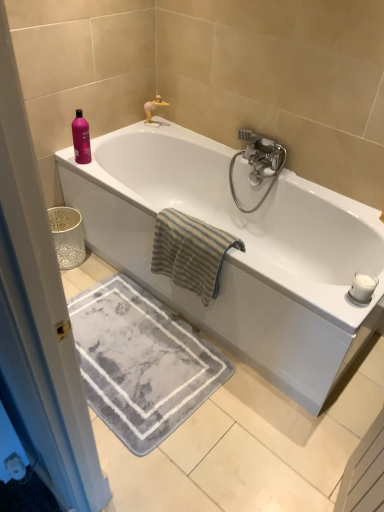
What are the coordinates of `free spot below gray soft rug at lower center (from a real-world perspective)` in the screenshot? It's located at (134, 360).